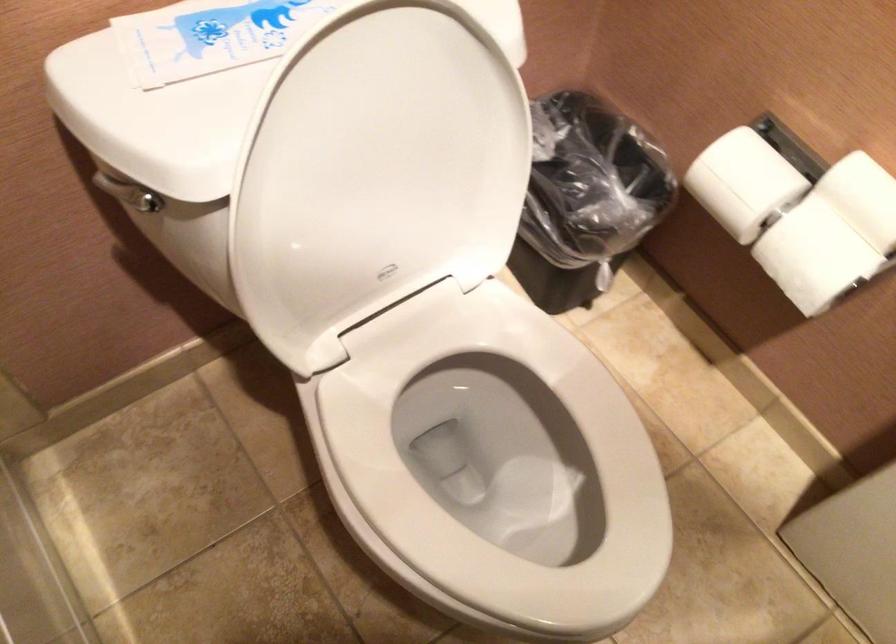
Looking at this image, the first image is from the beginning of the video and the second image is from the end. How did the camera likely rotate when shooting the video?

The rotation direction of the camera is right-up.